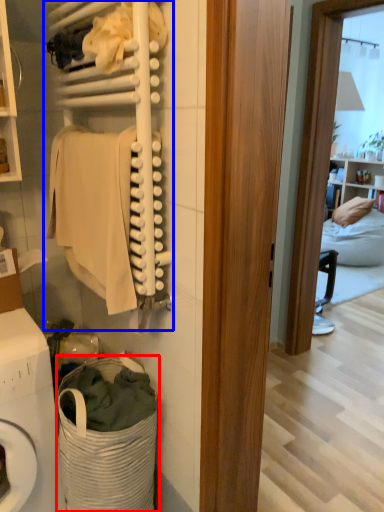
Question: Among these objects, which one is farthest to the camera, laundry basket (highlighted by a red box) or closet (highlighted by a blue box)?

Choices:
 (A) laundry basket
 (B) closet

Answer: (A)